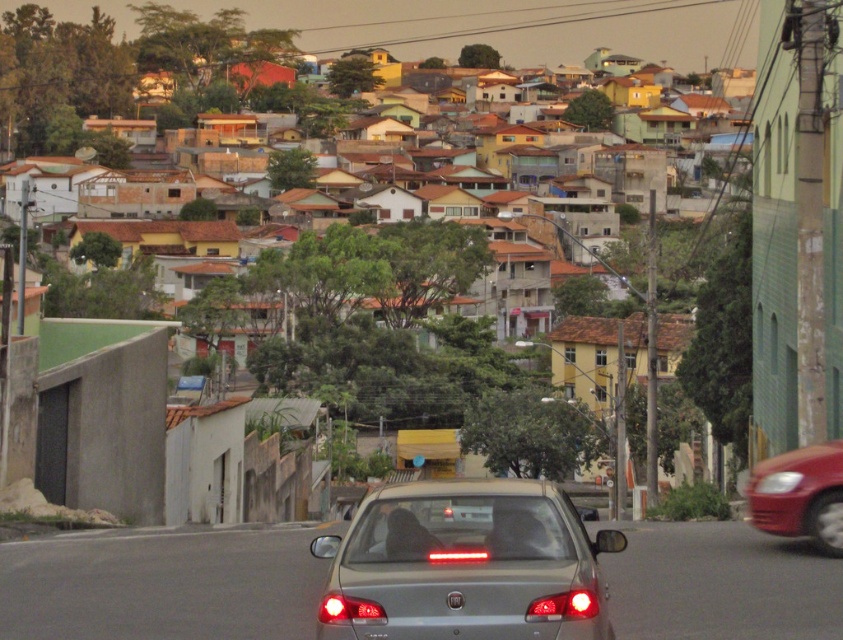
Question: Which of the following is the farthest from the observer?

Choices:
 (A) brown corrugated metal houses at upper center
 (B) satin silver sedan at center
 (C) shiny red car at right

Answer: (A)

Question: Which of the following is the farthest from the observer?

Choices:
 (A) (58, 136)
 (B) (525, 611)

Answer: (A)

Question: Is satin silver sedan at center to the left of shiny red car at right from the viewer's perspective?

Choices:
 (A) no
 (B) yes

Answer: (B)

Question: Does brown corrugated metal houses at upper center have a greater width compared to shiny red car at right?

Choices:
 (A) yes
 (B) no

Answer: (A)

Question: Which point is farther from the camera taking this photo?

Choices:
 (A) (24, 16)
 (B) (444, 592)
 (C) (812, 467)

Answer: (A)

Question: Does satin silver sedan at center appear over brown corrugated metal houses at upper center?

Choices:
 (A) no
 (B) yes

Answer: (A)